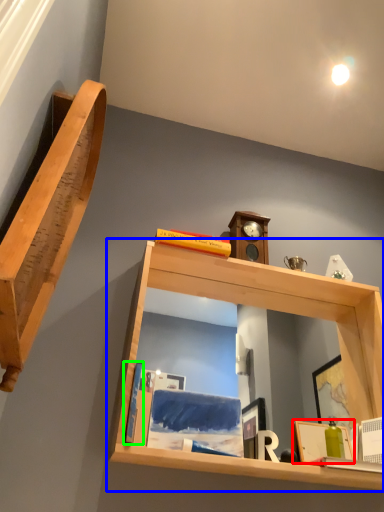
Question: Which object is positioned farthest from picture frame (highlighted by a red box)? Select from shelf (highlighted by a blue box) and book (highlighted by a green box).

Choices:
 (A) shelf
 (B) book

Answer: (B)